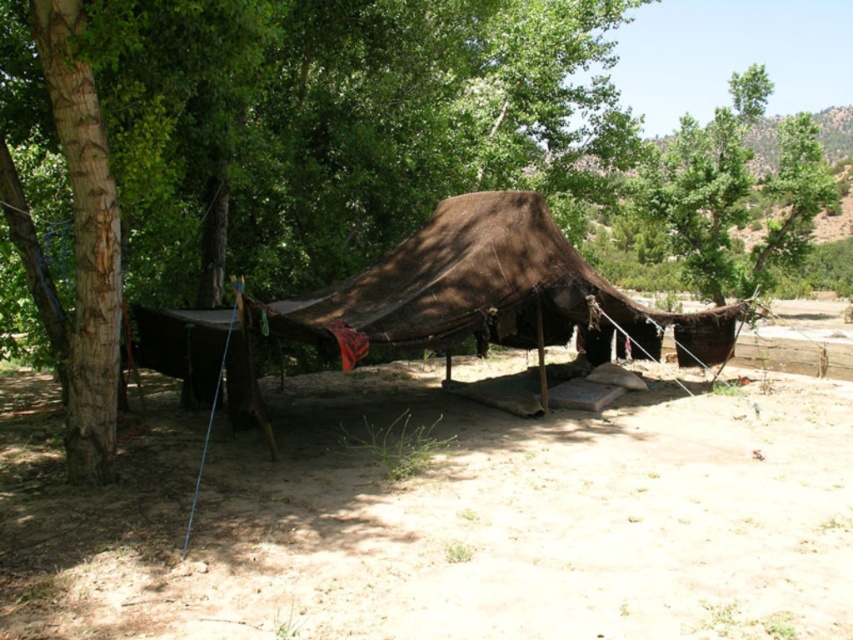
Consider the image. You are planning to set up a small garden in the brown dirt field at center near the brown canvas tent at center. Since both are at the center, which one occupies more space?

The brown dirt field at center is bigger than brown canvas tent at center, so the dirt field occupies more space.

You are planning to set up a small campfire in the brown dirt field at center. Considering the brown canvas tent at center is nearby, which object has a wider area to accommodate the fire safely?

The brown dirt field at center has a wider area than the brown canvas tent at center, so it is safer to set up the campfire there.

You are setting up a campsite and need to place a small fire pit. You have the brown dirt field at center and the brown canvas tent at center. Which location should you choose to ensure the fire pit is to the right of the tent?

The brown dirt field at center is to the right of the brown canvas tent at center, so placing the fire pit there would ensure it is to the right of the tent.